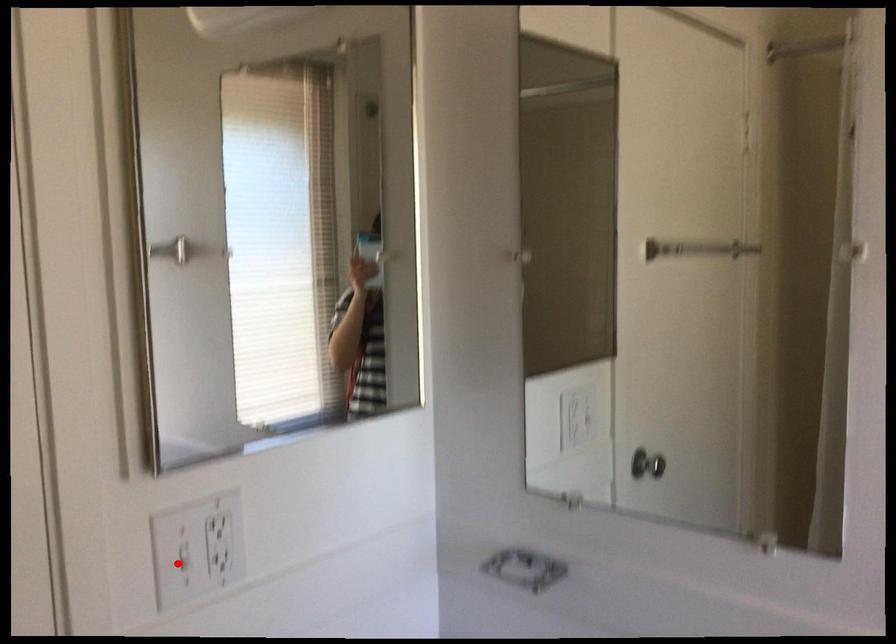
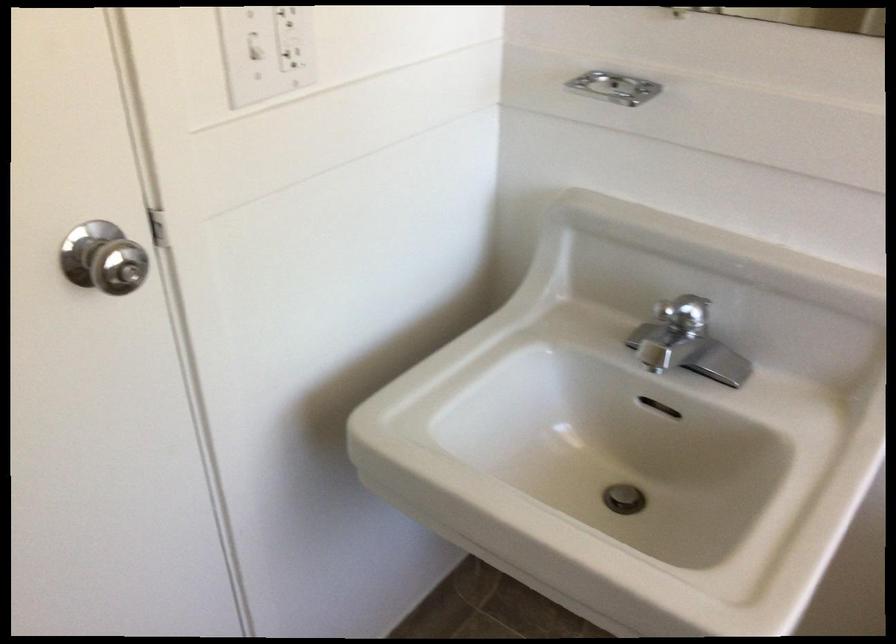
Question: I am providing you with two images of the same scene from different viewpoints. Image1 has a red point marked. In image2, the corresponding 3D location appears at what relative position? Reply with the corresponding letter.

Choices:
 (A) Closer
 (B) Farther

Answer: (A)